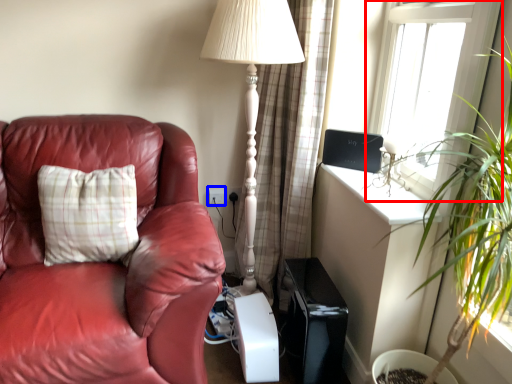
Question: Among these objects, which one is farthest to the camera, window (highlighted by a red box) or electric outlet (highlighted by a blue box)?

Choices:
 (A) window
 (B) electric outlet

Answer: (B)